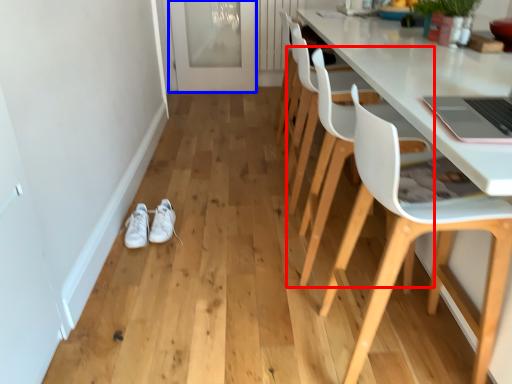
Question: Which object is further to the camera taking this photo, chair (highlighted by a red box) or glass door (highlighted by a blue box)?

Choices:
 (A) chair
 (B) glass door

Answer: (B)